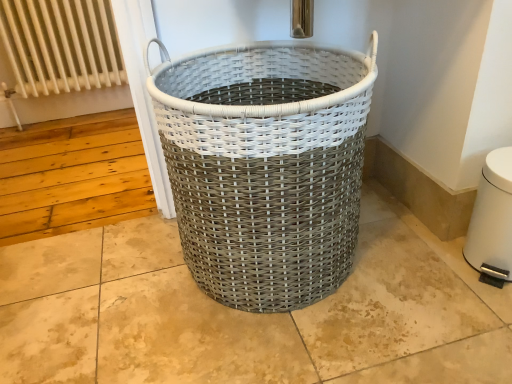
Where is `free region on the left part of white woven basket at center`? The width and height of the screenshot is (512, 384). free region on the left part of white woven basket at center is located at coordinates (105, 291).